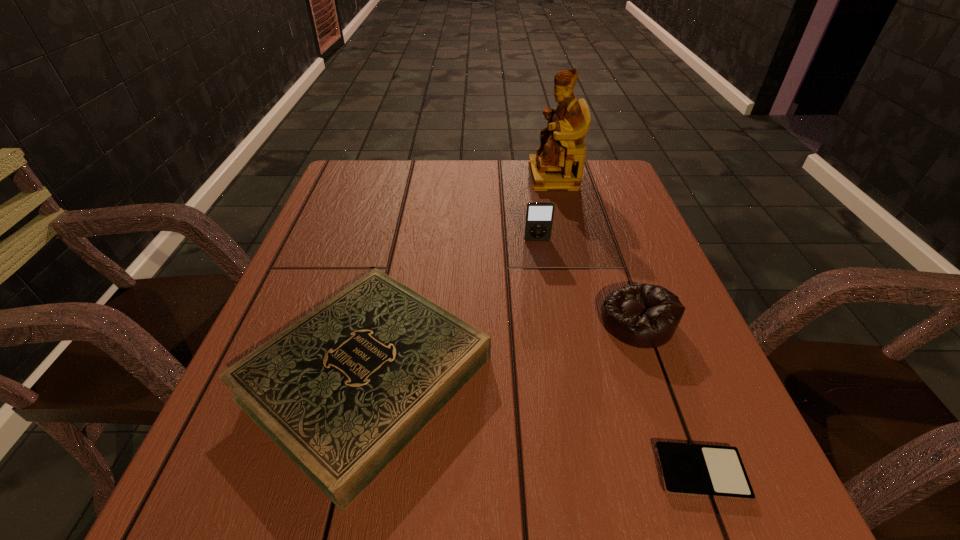
Locate an element on the screen. The height and width of the screenshot is (540, 960). vacant space that satisfies the following two spatial constraints: 1. on the front-facing side of the left iPod; 2. on the right side of the nearer iPod is located at coordinates (574, 472).